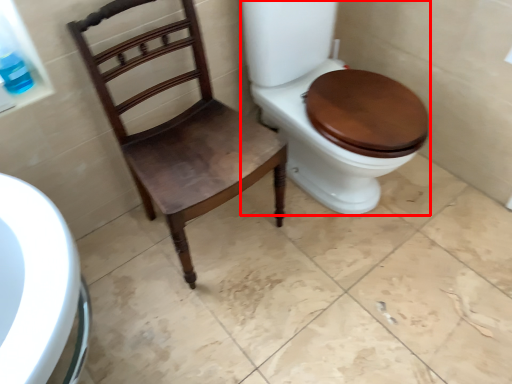
Question: Where is toilet (annotated by the red box) located in relation to chair in the image?

Choices:
 (A) left
 (B) right

Answer: (B)